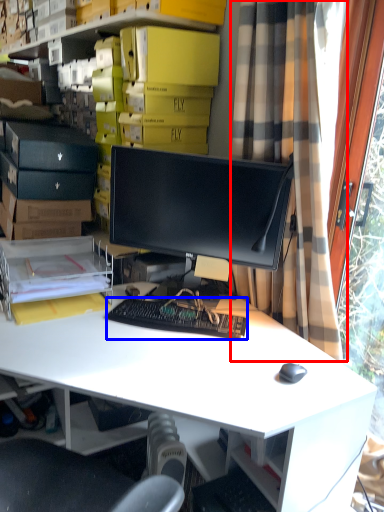
Question: Which point is further to the camera, curtain (highlighted by a red box) or computer keyboard (highlighted by a blue box)?

Choices:
 (A) curtain
 (B) computer keyboard

Answer: (B)